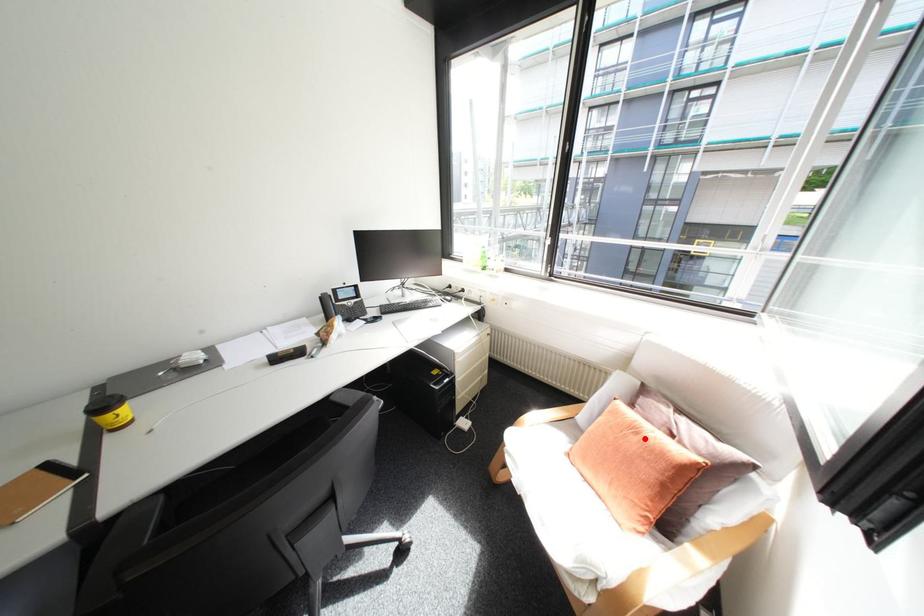
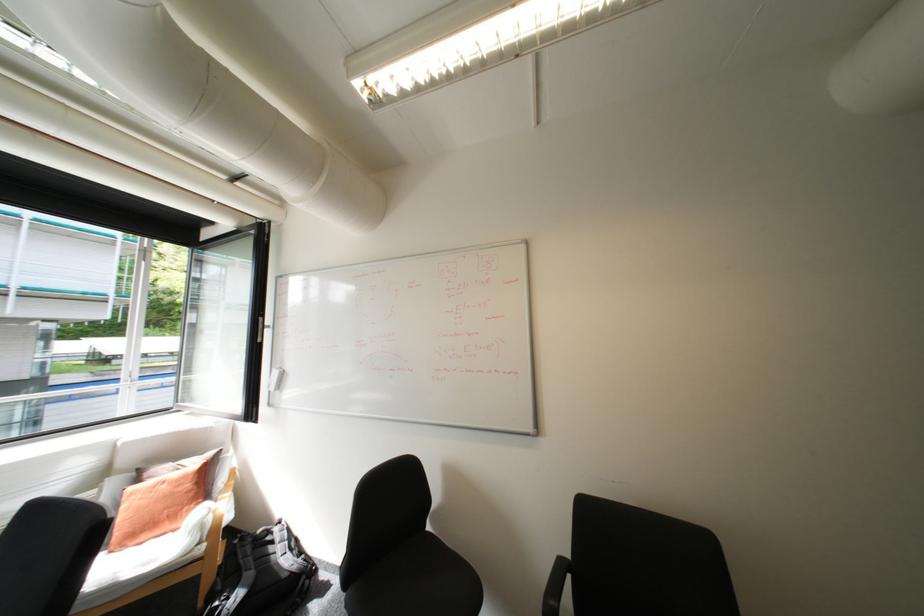
Where in the second image is the point corresponding to the highlighted location from the first image?

(175, 485)